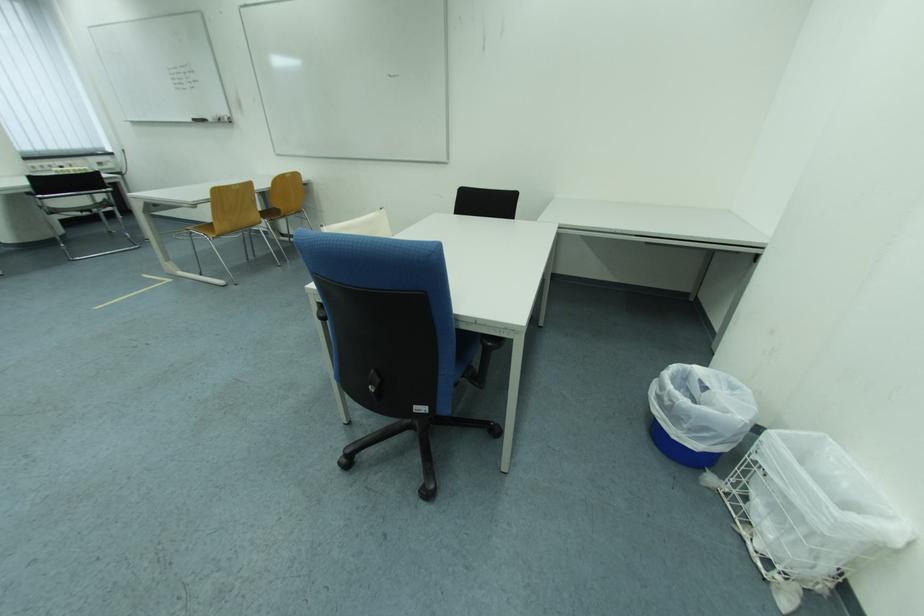
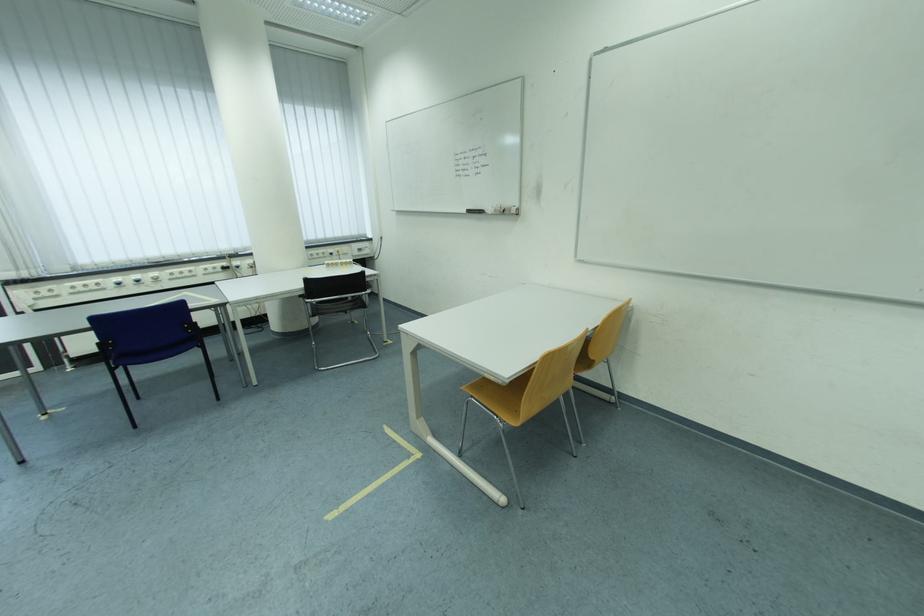
In a continuous first-person perspective shot, in which direction is the camera moving?

The cameraman walked toward left, forward.